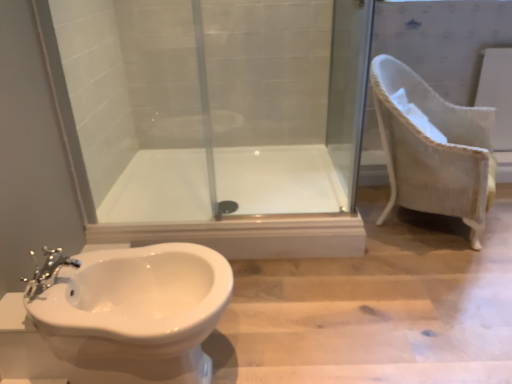
Find the location of `free space in front of chrome metallic faucet at lower left`. free space in front of chrome metallic faucet at lower left is located at coordinates (64, 310).